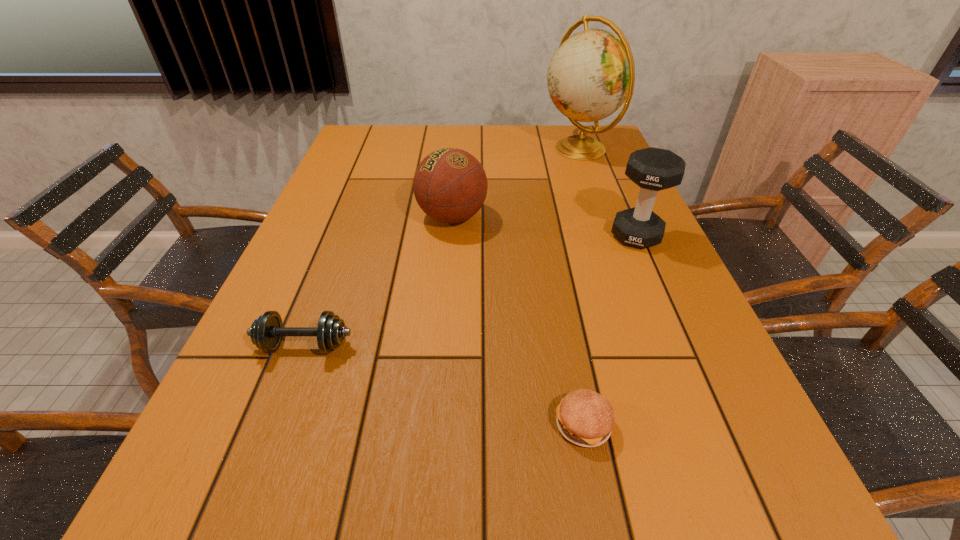
Locate an element on the screen. This screenshot has height=540, width=960. free space between the fourth tallest object and the second object from left to right is located at coordinates (378, 281).

The height and width of the screenshot is (540, 960). Identify the location of free space between the basketball and the farthest object. (516, 183).

You are a GUI agent. You are given a task and a screenshot of the screen. Output one action in this format:
    pyautogui.click(x=<x>, y=<y>)
    Task: Click on the empty location between the basketball and the nearest object
    
    Given the screenshot: What is the action you would take?
    pyautogui.click(x=517, y=321)

You are a GUI agent. You are given a task and a screenshot of the screen. Output one action in this format:
    pyautogui.click(x=<x>, y=<y>)
    Task: Click on the free space between the second object from left to right and the second nearest object
    This screenshot has height=540, width=960.
    Given the screenshot: What is the action you would take?
    pyautogui.click(x=378, y=281)

You are a GUI agent. You are given a task and a screenshot of the screen. Output one action in this format:
    pyautogui.click(x=<x>, y=<y>)
    Task: Click on the free spot between the fourth object from right to left and the farthest object
    
    Given the screenshot: What is the action you would take?
    pyautogui.click(x=516, y=183)

Choose which object is the second nearest neighbor to the nearer dumbbell. Please provide its 2D coordinates. Your answer should be formatted as a tuple, i.e. [(x, y)], where the tuple contains the x and y coordinates of a point satisfying the conditions above.

[(584, 417)]

This screenshot has width=960, height=540. I want to click on object that ranks as the closest to the left dumbbell, so click(x=450, y=185).

The width and height of the screenshot is (960, 540). In order to click on blank area in the image that satisfies the following two spatial constraints: 1. on the back side of the globe; 2. on the right side of the basketball in this screenshot , I will do tap(458, 148).

Where is `free location that satisfies the following two spatial constraints: 1. on the front side of the leftmost object; 2. on the right side of the shortest object`? This screenshot has height=540, width=960. free location that satisfies the following two spatial constraints: 1. on the front side of the leftmost object; 2. on the right side of the shortest object is located at coordinates (275, 424).

Locate an element on the screen. This screenshot has width=960, height=540. vacant position in the image that satisfies the following two spatial constraints: 1. on the front side of the farther dumbbell; 2. on the left side of the globe is located at coordinates (612, 236).